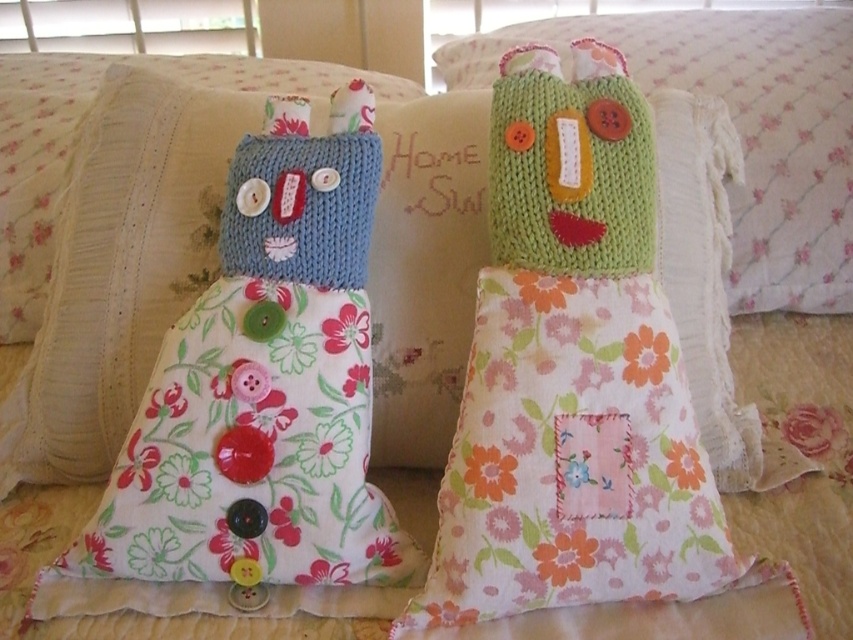
Question: Where is knitted green doll at center located in relation to green knitted pillow at center in the image?

Choices:
 (A) below
 (B) above

Answer: (A)

Question: Does knitted green doll at center appear under green knitted pillow at center?

Choices:
 (A) no
 (B) yes

Answer: (B)

Question: Which point is farther from the camera taking this photo?

Choices:
 (A) (747, 232)
 (B) (611, 353)

Answer: (A)

Question: Which of the following is the farthest from the observer?

Choices:
 (A) knitted green doll at center
 (B) green knitted pillow at center

Answer: (B)

Question: Is knitted green doll at center wider than green knitted pillow at center?

Choices:
 (A) yes
 (B) no

Answer: (B)